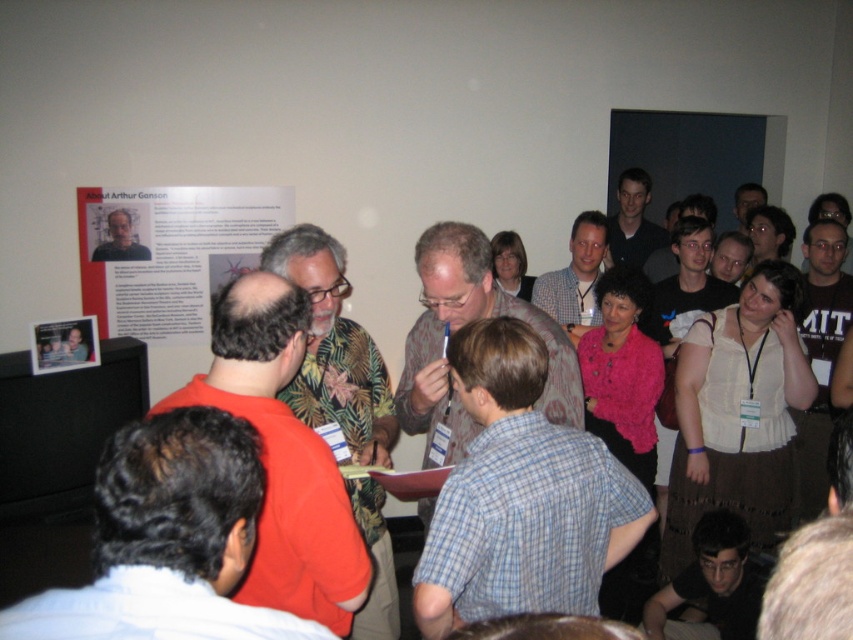
You are organizing a group photo and need to arrange the participants based on their clothing. Given the blue plaid shirt at center and the matte gray shirt at center, which shirt should be placed in a position that requires less space to accommodate its size?

The blue plaid shirt at center occupies less space than the matte gray shirt at center, so it should be placed in the position that requires less space to accommodate its size.